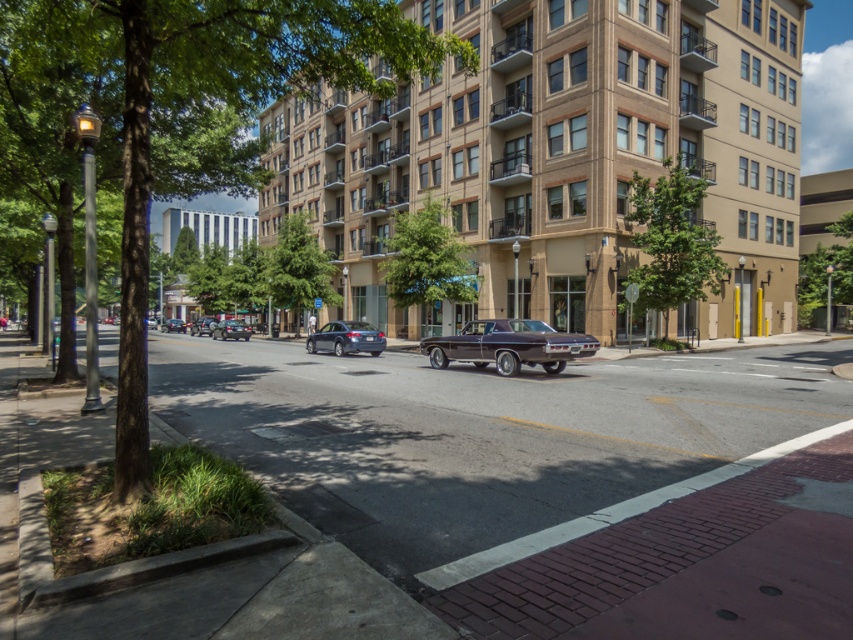
Does shiny silver sedan at center-left have a lesser width compared to shiny black sedan at center-left?

Yes, shiny silver sedan at center-left is thinner than shiny black sedan at center-left.

Can you confirm if shiny silver sedan at center-left is smaller than shiny black sedan at center-left?

Yes.

At what (x,y) coordinates should I click in order to perform the action: click on shiny silver sedan at center-left. Please return your answer as a coordinate pair (x, y). The height and width of the screenshot is (640, 853). Looking at the image, I should click on (202, 324).

Does shiny brown car at center appear over shiny silver sedan at center-left?

No.

The height and width of the screenshot is (640, 853). In order to click on shiny brown car at center in this screenshot , I will do `click(508, 346)`.

At what (x,y) coordinates should I click in order to perform the action: click on shiny brown car at center. Please return your answer as a coordinate pair (x, y). This screenshot has width=853, height=640. Looking at the image, I should click on (508, 346).

Is shiny black sedan at center bigger than shiny silver sedan at center-left?

Actually, shiny black sedan at center might be smaller than shiny silver sedan at center-left.

Can you confirm if shiny black sedan at center is positioned to the left of shiny silver sedan at center-left?

Incorrect, shiny black sedan at center is not on the left side of shiny silver sedan at center-left.

Measure the distance between shiny black sedan at center and camera.

They are 45.81 meters apart.

Where is `shiny black sedan at center`? shiny black sedan at center is located at coordinates (230, 330).